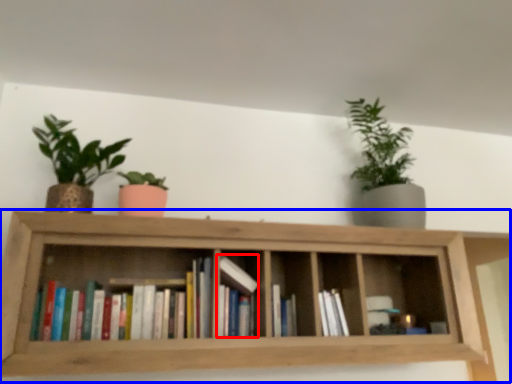
Question: Among these objects, which one is farthest to the camera, book (highlighted by a red box) or shelf (highlighted by a blue box)?

Choices:
 (A) book
 (B) shelf

Answer: (A)